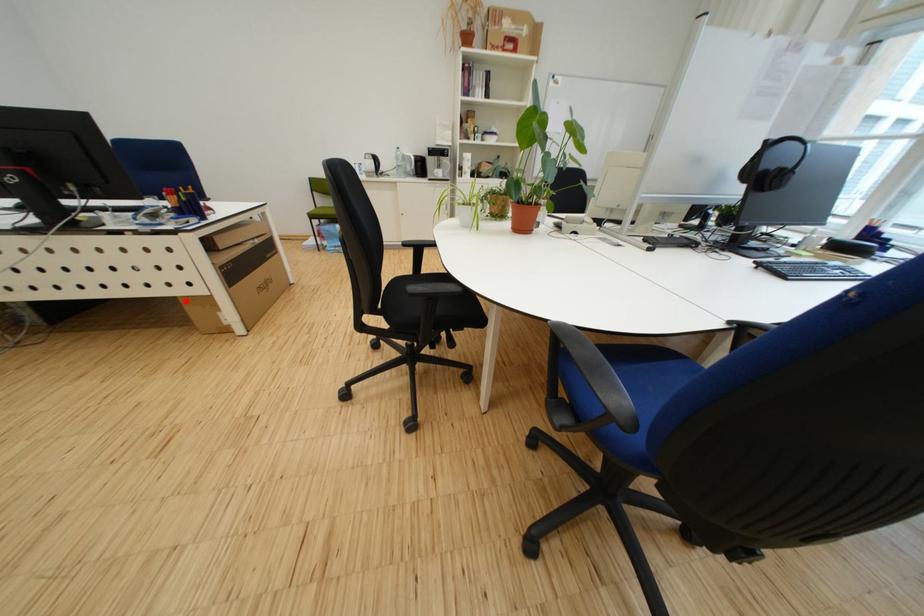
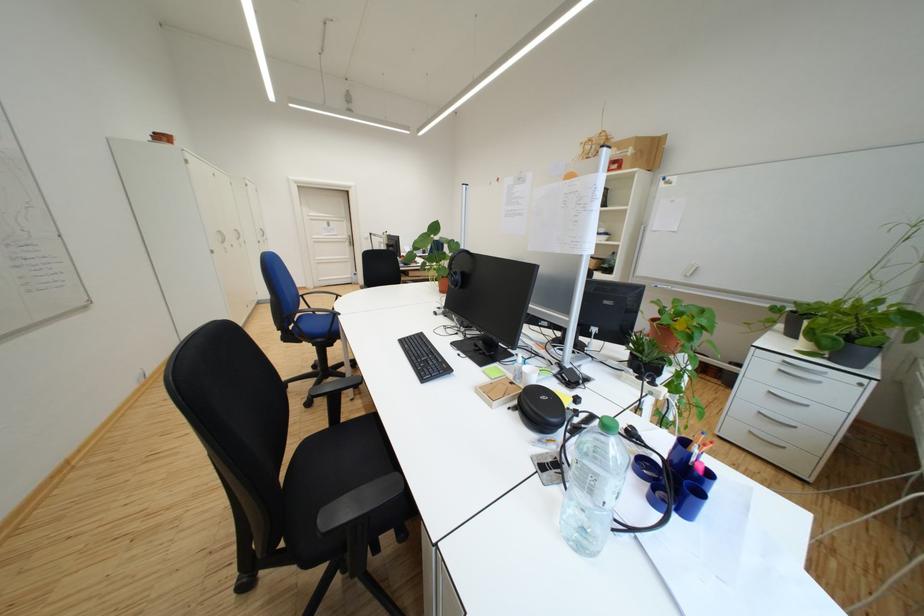
Question: I am providing you with two images of the same scene from different viewpoints. A red point is marked on the first image. Can you still see the location of the red point in image 2?

Choices:
 (A) Yes
 (B) No

Answer: (B)